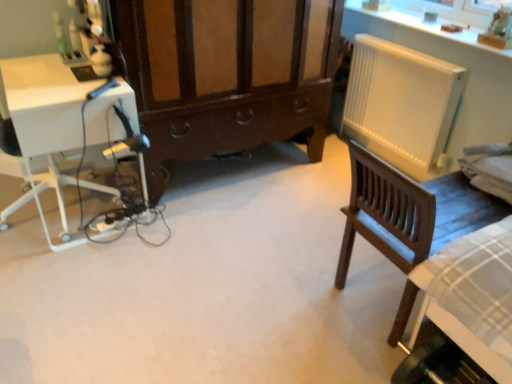
In order to click on vacant space that's between white plastic computer desk at left and dark wood chair at right in this screenshot , I will do `click(243, 250)`.